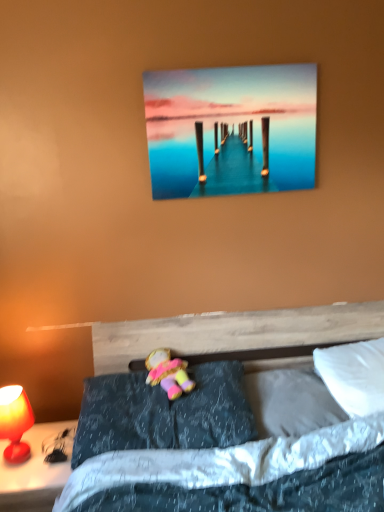
Question: Is matte red lamp at lower left wider than metallic glossy pier at upper center?

Choices:
 (A) no
 (B) yes

Answer: (B)

Question: Is matte red lamp at lower left located outside metallic glossy pier at upper center?

Choices:
 (A) no
 (B) yes

Answer: (B)

Question: Does matte red lamp at lower left have a greater height compared to metallic glossy pier at upper center?

Choices:
 (A) yes
 (B) no

Answer: (B)

Question: From the image's perspective, is matte red lamp at lower left on metallic glossy pier at upper center?

Choices:
 (A) yes
 (B) no

Answer: (B)

Question: Does matte red lamp at lower left have a larger size compared to metallic glossy pier at upper center?

Choices:
 (A) no
 (B) yes

Answer: (B)

Question: Is point (122, 443) positioned closer to the camera than point (297, 368)?

Choices:
 (A) closer
 (B) farther

Answer: (A)

Question: Relative to white soft pillow at lower right, which is the second pillow from right to left, is dark gray fabric pillow at center, placed as the 3th pillow when sorted from right to left, in front or behind?

Choices:
 (A) behind
 (B) front

Answer: (B)

Question: From their relative heights in the image, would you say dark gray fabric pillow at center, which appears as the 1th pillow when viewed from the left, is taller or shorter than white soft pillow at lower right, which appears as the 2th pillow when viewed from the left?

Choices:
 (A) short
 (B) tall

Answer: (B)

Question: Is dark gray fabric pillow at center, which appears as the 1th pillow when viewed from the left, inside the boundaries of white soft pillow at lower right, which appears as the 2th pillow when viewed from the left, or outside?

Choices:
 (A) outside
 (B) inside

Answer: (A)

Question: Looking at their shapes, would you say dark gray fabric pillow at center, which appears as the 1th pillow when viewed from the left, is wider or thinner than white soft pillow at upper right, the third pillow from the left?

Choices:
 (A) wide
 (B) thin

Answer: (A)

Question: From the image's perspective, relative to white soft pillow at upper right, the third pillow from the left, is dark gray fabric pillow at center, which appears as the 1th pillow when viewed from the left, above or below?

Choices:
 (A) below
 (B) above

Answer: (A)

Question: Based on their sizes in the image, would you say dark gray fabric pillow at center, placed as the 3th pillow when sorted from right to left, is bigger or smaller than white soft pillow at upper right, the third pillow from the left?

Choices:
 (A) big
 (B) small

Answer: (A)

Question: From a real-world perspective, relative to white soft pillow at upper right, which appears as the 1th pillow when viewed from the right, is dark gray fabric pillow at center, placed as the 3th pillow when sorted from right to left, vertically above or below?

Choices:
 (A) below
 (B) above

Answer: (A)

Question: Looking at their shapes, would you say metallic glossy pier at upper center is wider or thinner than matte red lamp at left?

Choices:
 (A) wide
 (B) thin

Answer: (B)

Question: In the image, is metallic glossy pier at upper center on the left side or the right side of matte red lamp at left?

Choices:
 (A) right
 (B) left

Answer: (A)